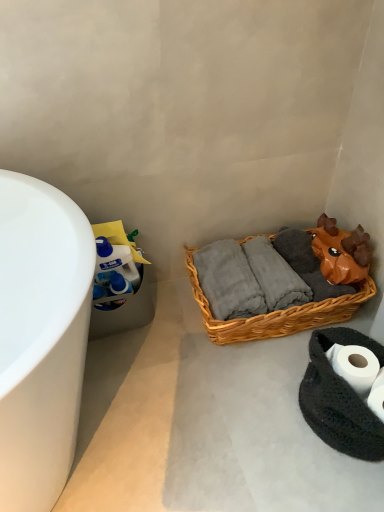
Locate an element on the screen. This screenshot has height=512, width=384. free region on the left part of black knitted rug at lower right is located at coordinates (264, 422).